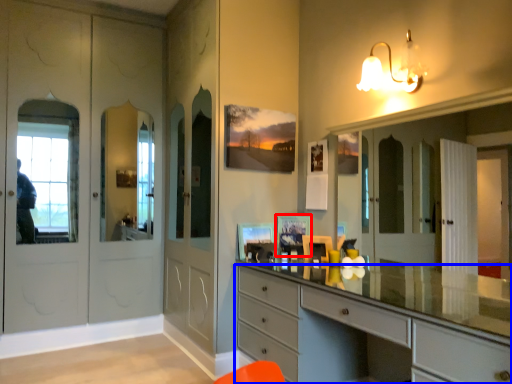
Question: Which object is further to the camera taking this photo, picture frame (highlighted by a red box) or chest of drawers (highlighted by a blue box)?

Choices:
 (A) picture frame
 (B) chest of drawers

Answer: (A)